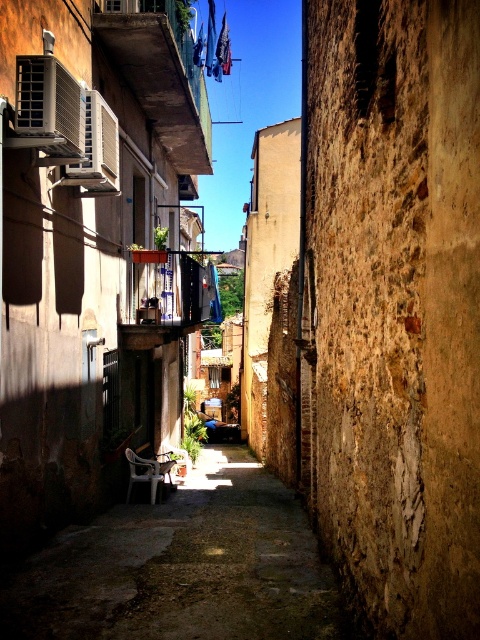
Image resolution: width=480 pixels, height=640 pixels. Find the location of `rustic stone wall at center`. rustic stone wall at center is located at coordinates (394, 307).

Can you confirm if rustic stone wall at center is positioned above smooth concrete alley at center?

Yes, rustic stone wall at center is above smooth concrete alley at center.

You are a GUI agent. You are given a task and a screenshot of the screen. Output one action in this format:
    pyautogui.click(x=<x>, y=<y>)
    Task: Click on the rustic stone wall at center
    This screenshot has width=480, height=640.
    Given the screenshot: What is the action you would take?
    pyautogui.click(x=394, y=307)